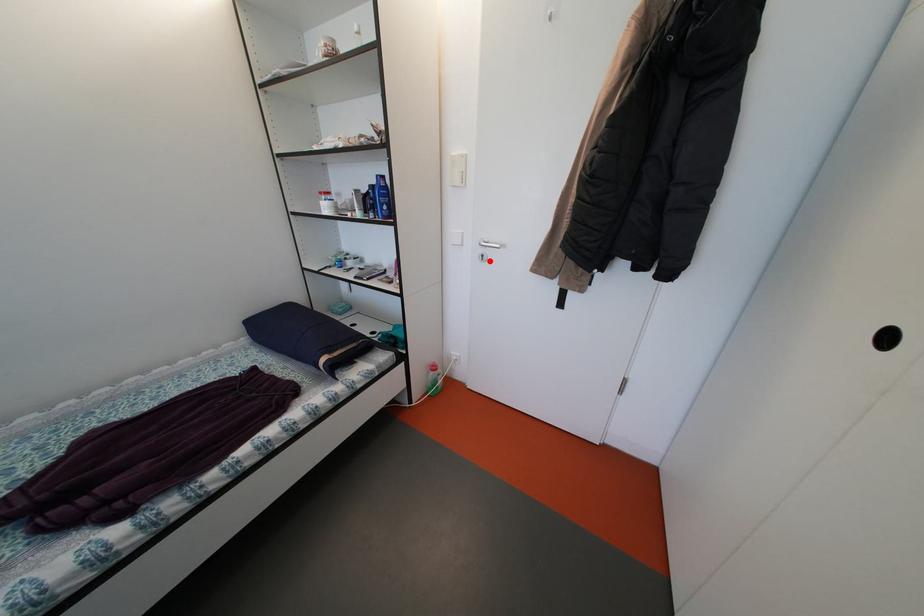
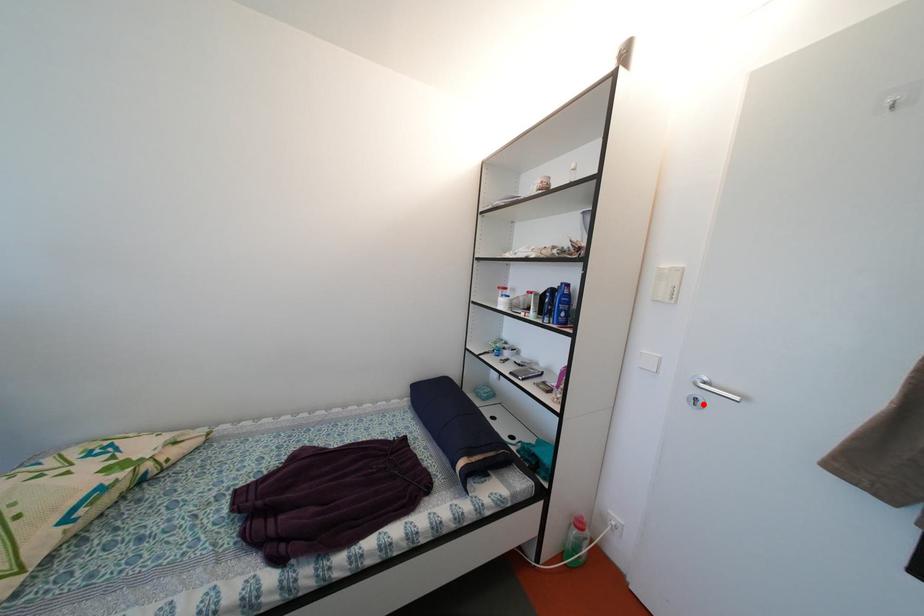
I am providing you with two images of the same scene from different viewpoints. A red point is marked on the first image and another point is marked on the second image. Do the highlighted points in image1 and image2 indicate the same real-world spot?

Yes